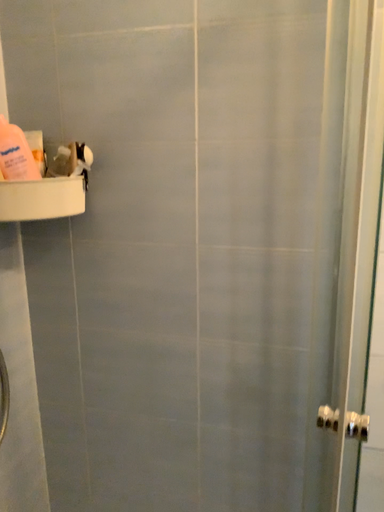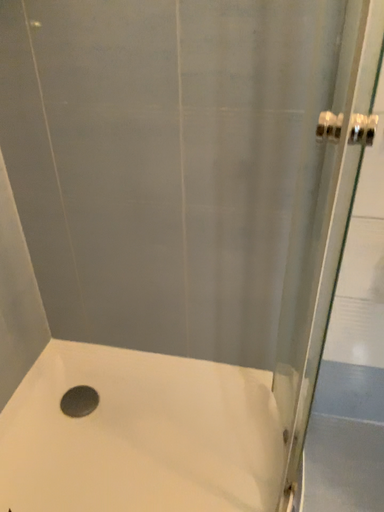
Question: How did the camera likely rotate when shooting the video?

Choices:
 (A) rotated downward
 (B) rotated upward

Answer: (A)